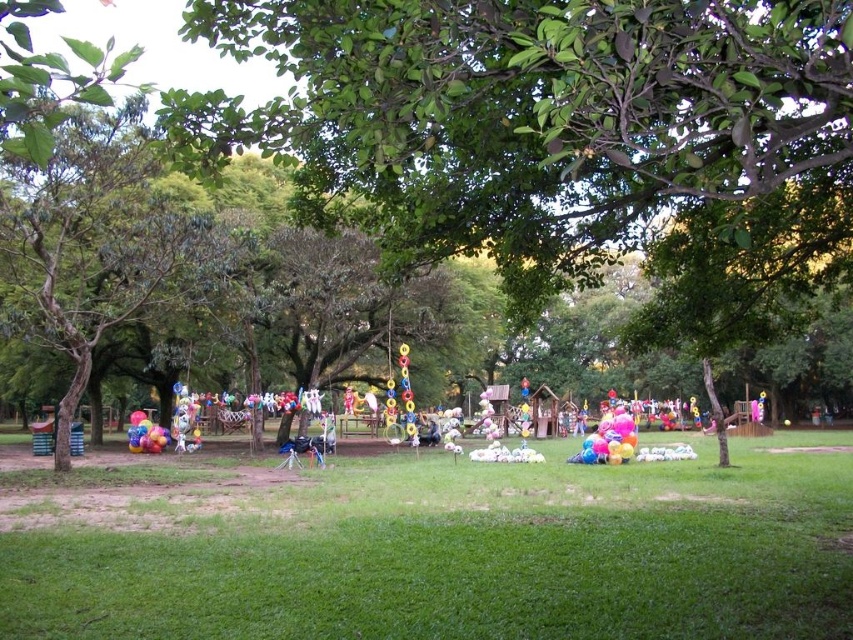
Question: Is green leafy tree at center above green grass at center?

Choices:
 (A) no
 (B) yes

Answer: (B)

Question: Among these objects, which one is nearest to the camera?

Choices:
 (A) green leafy tree at center
 (B) green grass at center

Answer: (A)

Question: From the image, what is the correct spatial relationship of green leafy tree at center in relation to green grass at center?

Choices:
 (A) below
 (B) above

Answer: (B)

Question: Does green leafy tree at center have a lesser width compared to green grass at center?

Choices:
 (A) yes
 (B) no

Answer: (A)